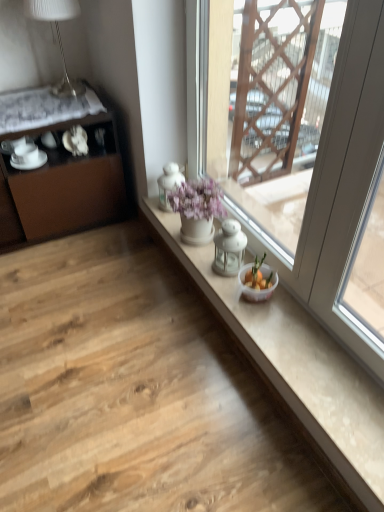
Locate an element on the screen. Image resolution: width=384 pixels, height=512 pixels. vacant area on top of white glossy counter top at center (from a real-world perspective) is located at coordinates (294, 345).